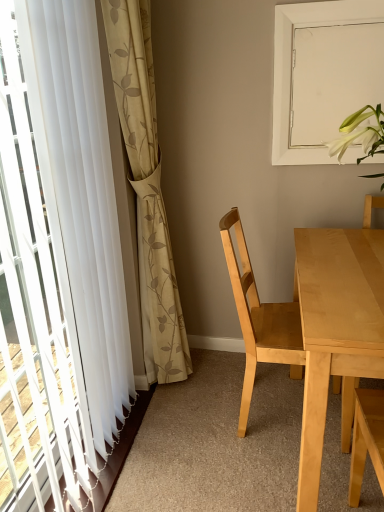
This screenshot has height=512, width=384. In order to click on free point in front of light wood chair at center in this screenshot , I will do `click(260, 472)`.